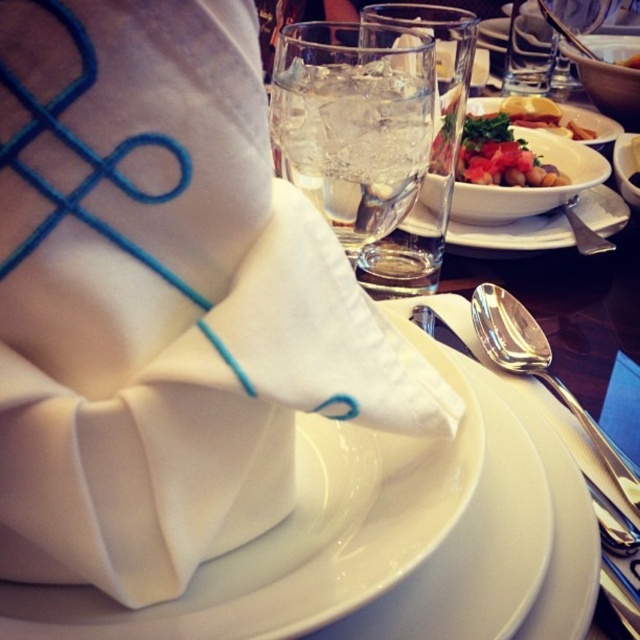
Is the position of white fabric napkin at center less distant than that of clear glass water at center?

That is True.

The height and width of the screenshot is (640, 640). What are the coordinates of `white fabric napkin at center` in the screenshot? It's located at (163, 300).

This screenshot has height=640, width=640. In order to click on white fabric napkin at center in this screenshot , I will do `click(163, 300)`.

Measure the distance from white fabric napkin at center to satin silver spoon at right.

white fabric napkin at center and satin silver spoon at right are 15.18 centimeters apart.

Is white fabric napkin at center above satin silver spoon at right?

Indeed, white fabric napkin at center is positioned over satin silver spoon at right.

Is point (42, 300) positioned after point (481, 320)?

No, it is in front of (481, 320).

The width and height of the screenshot is (640, 640). I want to click on white fabric napkin at center, so click(163, 300).

How distant is clear glass water at center from smooth orange carrot at upper right?

A distance of 15.42 inches exists between clear glass water at center and smooth orange carrot at upper right.

This screenshot has width=640, height=640. Describe the element at coordinates (355, 122) in the screenshot. I see `clear glass water at center` at that location.

Where is `clear glass water at center`? clear glass water at center is located at coordinates (355, 122).